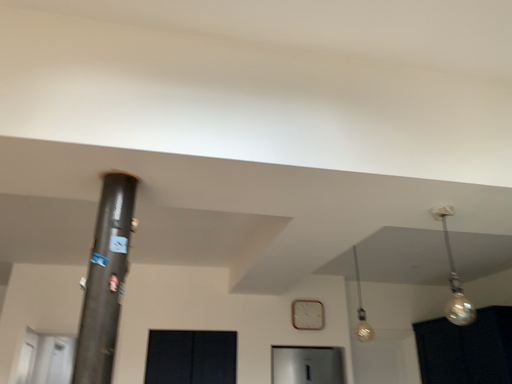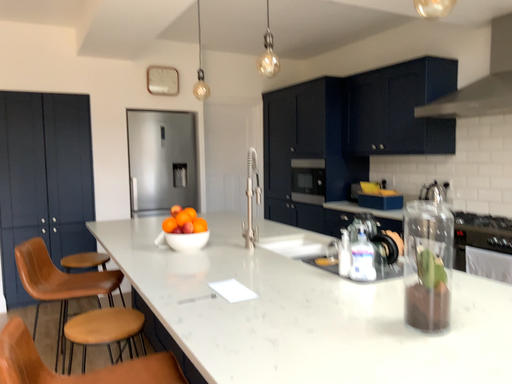
Question: How did the camera likely rotate when shooting the video?

Choices:
 (A) rotated downward
 (B) rotated upward

Answer: (A)